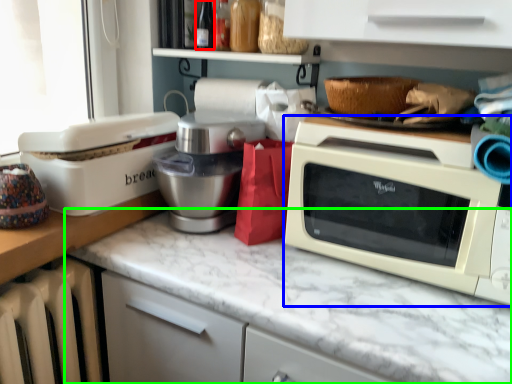
Question: Which is farther away from bottle (highlighted by a red box)? microwave oven (highlighted by a blue box) or countertop (highlighted by a green box)?

Choices:
 (A) microwave oven
 (B) countertop

Answer: (B)